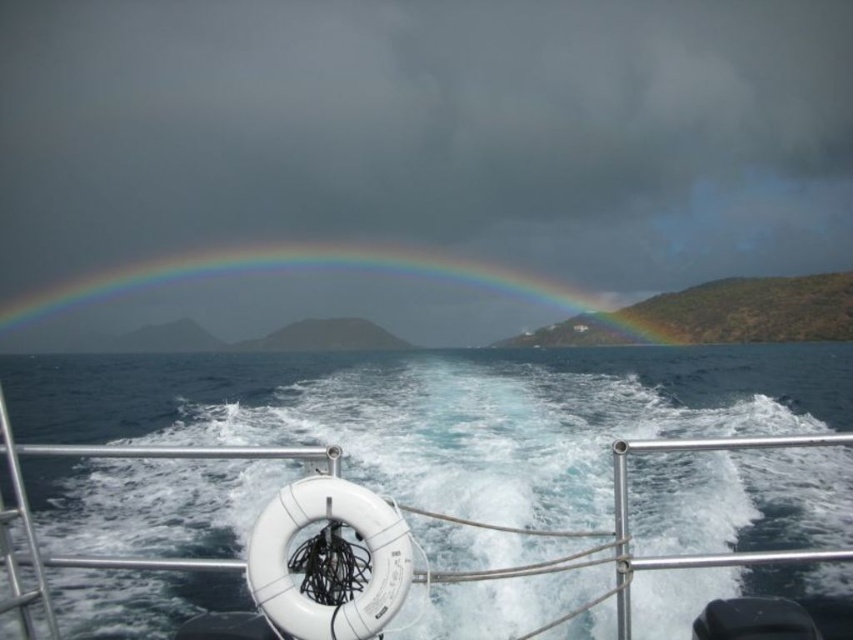
Question: Can you confirm if blue water at center is positioned to the right of rainbow at center?

Choices:
 (A) no
 (B) yes

Answer: (B)

Question: Is blue water at center thinner than rainbow at center?

Choices:
 (A) yes
 (B) no

Answer: (A)

Question: Is blue water at center in front of rainbow at center?

Choices:
 (A) no
 (B) yes

Answer: (B)